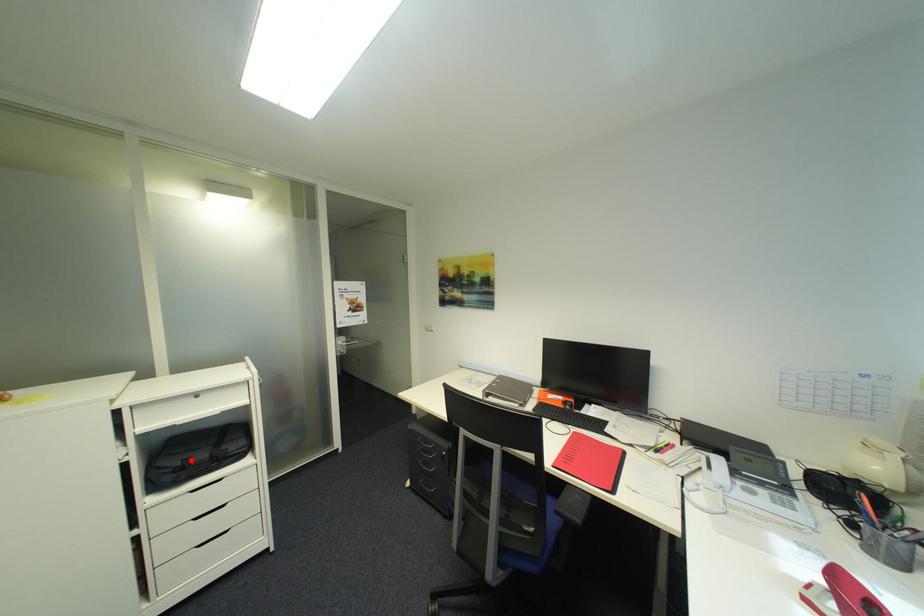
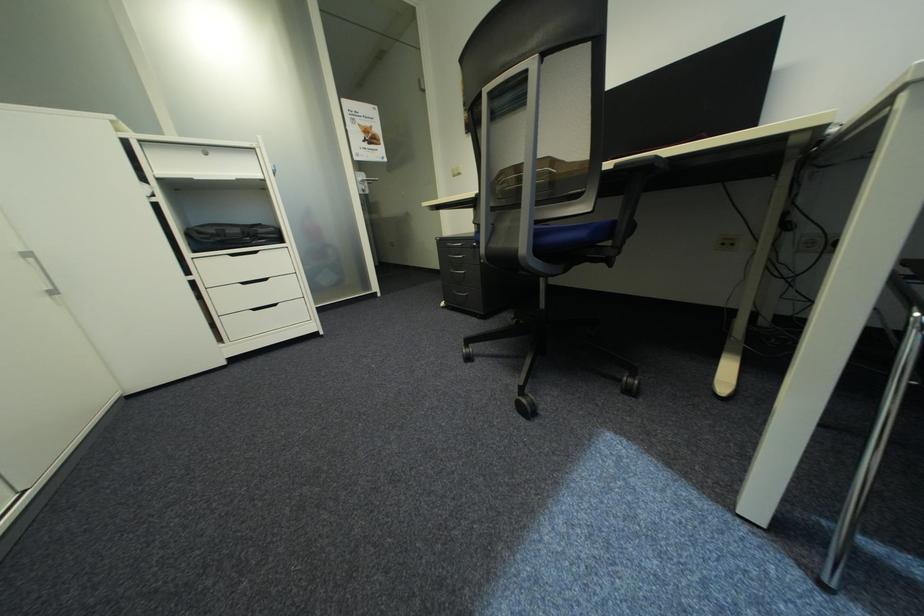
In the second image, find the point that corresponds to the highlighted location in the first image.

(225, 230)